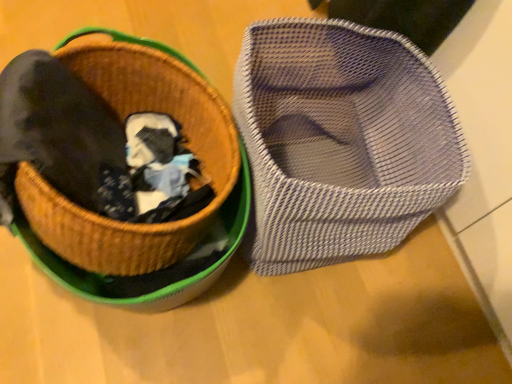
Question: In terms of size, does mesh fabric shoe at right appear bigger or smaller than woven straw basket at upper left?

Choices:
 (A) small
 (B) big

Answer: (A)

Question: Is mesh fabric shoe at right wider or thinner than woven straw basket at upper left?

Choices:
 (A) thin
 (B) wide

Answer: (A)

Question: Is point (330, 208) closer or farther from the camera than point (50, 205)?

Choices:
 (A) farther
 (B) closer

Answer: (A)

Question: In terms of width, does woven straw basket at upper left look wider or thinner when compared to mesh fabric shoe at right?

Choices:
 (A) wide
 (B) thin

Answer: (A)

Question: Is woven straw basket at upper left bigger or smaller than mesh fabric shoe at right?

Choices:
 (A) big
 (B) small

Answer: (A)

Question: In terms of height, does woven straw basket at upper left look taller or shorter compared to mesh fabric shoe at right?

Choices:
 (A) short
 (B) tall

Answer: (A)

Question: From the image's perspective, relative to mesh fabric shoe at right, is woven straw basket at upper left above or below?

Choices:
 (A) below
 (B) above

Answer: (B)